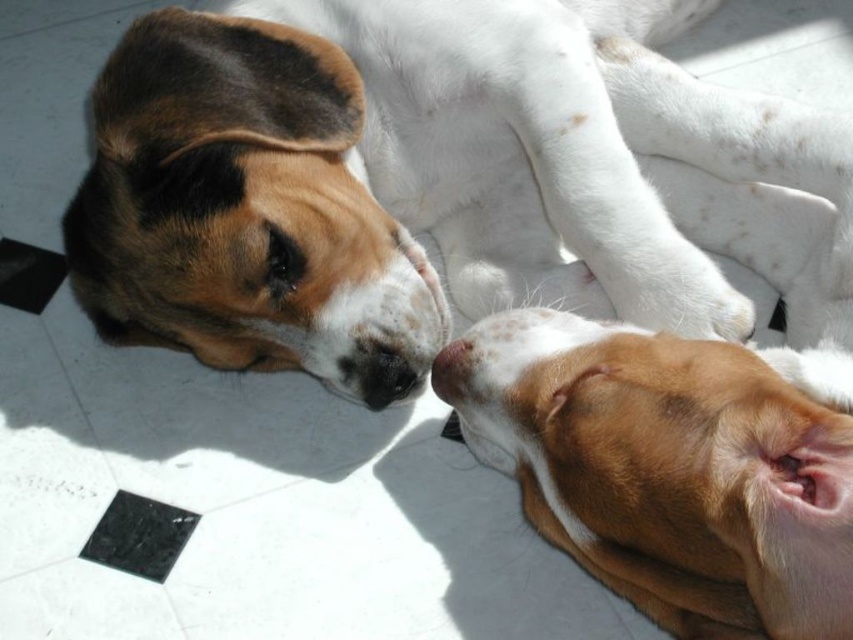
You are a photographer trying to capture a closeup of the brown and white fur at upper left and the brown soft fur at lower right. Since you can only focus on one subject at a time, which fur should you focus on first if you want to ensure the other is in the background?

You should focus on the brown and white fur at upper left first because it is above the brown soft fur at lower right, so the brown soft fur at lower right will naturally be in the background.

You are a dog groomer observing two dogs in the image. The dogs are lying on a tiled floor. The larger dog has brown and white fur at upper left, and the smaller one has brown soft fur at lower right. Which dog would require a larger grooming table to accommodate its size?

The brown and white fur at upper left is larger in size than brown soft fur at lower right, so the larger dog with brown and white fur at upper left would need a larger grooming table to accommodate its size.